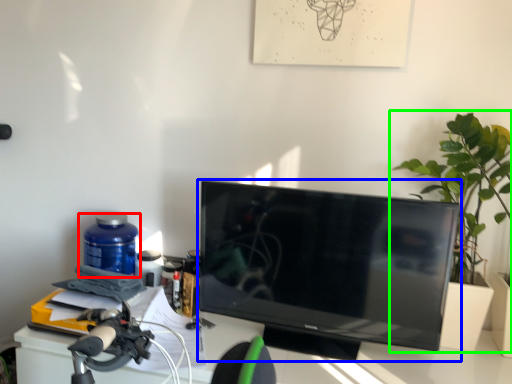
Question: Based on their relative distances, which object is farther from bottle (highlighted by a red box)? Choose from television (highlighted by a blue box) and houseplant (highlighted by a green box).

Choices:
 (A) television
 (B) houseplant

Answer: (B)